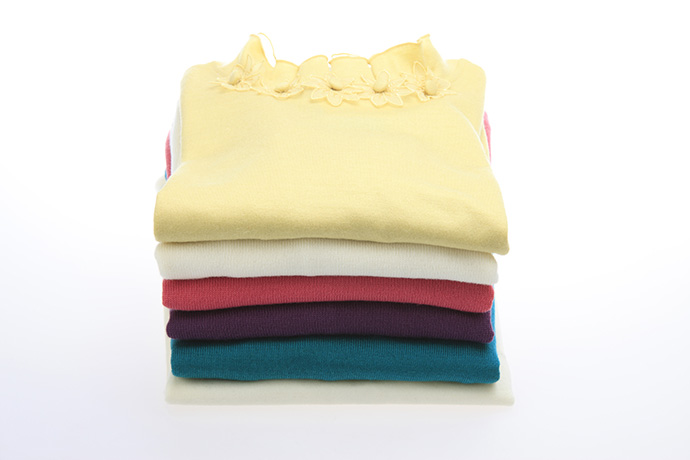
Identify the location of folded sweater. The width and height of the screenshot is (690, 460). (310, 165), (245, 266), (212, 304), (241, 325), (265, 354), (221, 401).